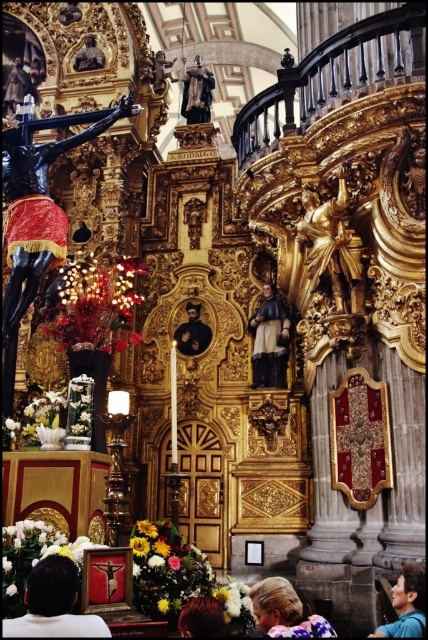
Who is shorter, smooth wood statue at upper center or smooth gold statue at upper center?

Standing shorter between the two is smooth wood statue at upper center.

Which is in front, point (89, 60) or point (155, 61)?

Point (89, 60) is more forward.

The image size is (428, 640). I want to click on smooth wood statue at upper center, so click(89, 54).

Based on the photo, does polished bronze statue at upper center appear on the left side of dark brown hair at lower center?

Indeed, polished bronze statue at upper center is positioned on the left side of dark brown hair at lower center.

What do you see at coordinates (196, 92) in the screenshot? I see `polished bronze statue at upper center` at bounding box center [196, 92].

Is point (205, 104) closer to viewer compared to point (195, 630)?

No.

What are the coordinates of `polished bronze statue at upper center` in the screenshot? It's located at (196, 92).

Can you confirm if matte black statue at center is positioned below smooth gold statue at center?

Yes.

Consider the image. Between matte black statue at center and smooth gold statue at center, which one appears on the left side from the viewer's perspective?

matte black statue at center

Describe the element at coordinates (53, 604) in the screenshot. I see `matte black statue at center` at that location.

Identify the location of matte black statue at center. Image resolution: width=428 pixels, height=640 pixels. (53, 604).